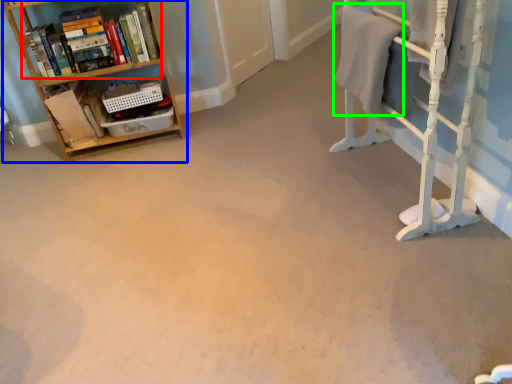
Question: Which object is the farthest from book (highlighted by a red box)? Choose among these: shelf (highlighted by a blue box) or bath towel (highlighted by a green box).

Choices:
 (A) shelf
 (B) bath towel

Answer: (B)